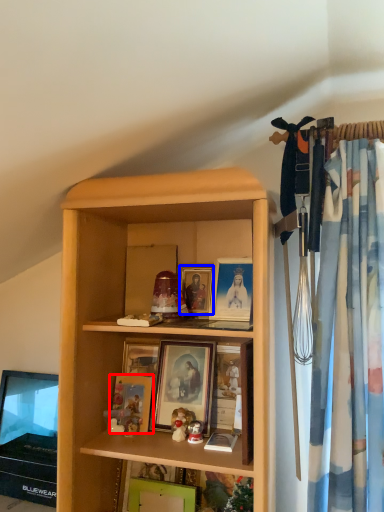
Question: Which point is closer to the camera, picture frame (highlighted by a red box) or picture frame (highlighted by a blue box)?

Choices:
 (A) picture frame
 (B) picture frame

Answer: (A)